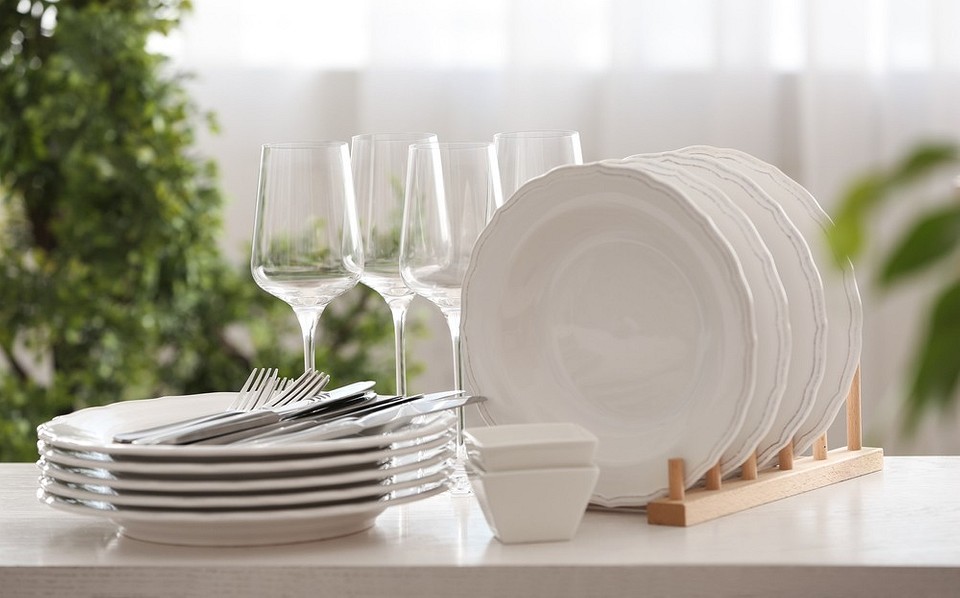
Where is `knives`? This screenshot has height=598, width=960. knives is located at coordinates (245, 417), (245, 430), (276, 430), (324, 428).